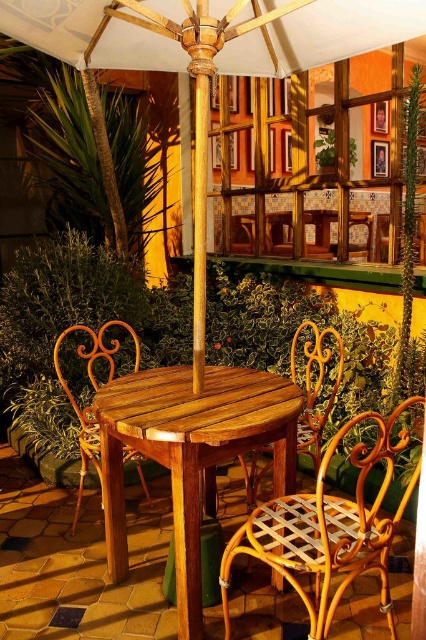
You are standing at the center of the seating area and want to place a small potted plant between the two points labeled point (x=307, y=364) and point (x=138, y=461). Which point should the plant be closer to in order to be positioned behind the second point?

The plant should be closer to point (x=138, y=461) because point (x=307, y=364) is behind it, so placing the plant near point (x=138, y=461) ensures it is in front of the first point.

You are a person who is 160 cm tall and want to sit comfortably at the table. Considering the light brown woven wood chair at lower right and the wooden wicker chair at left, which chair would be more suitable for your height?

The light brown woven wood chair at lower right has a lesser height compared to the wooden wicker chair at left. Since you are 160 cm tall, the wooden wicker chair at left would be more suitable as it offers a higher seat, providing better comfort and posture.